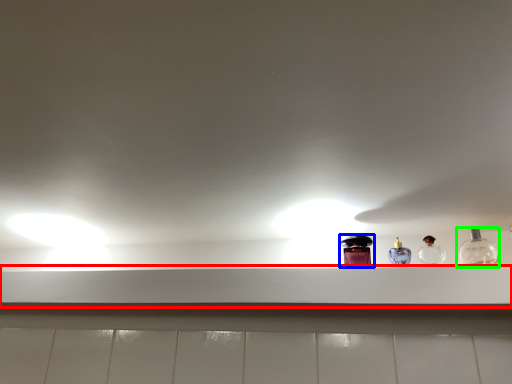
Question: Based on their relative distances, which object is farther from window sill (highlighted by a red box)? Choose from bottle (highlighted by a blue box) and bottle (highlighted by a green box).

Choices:
 (A) bottle
 (B) bottle

Answer: (B)